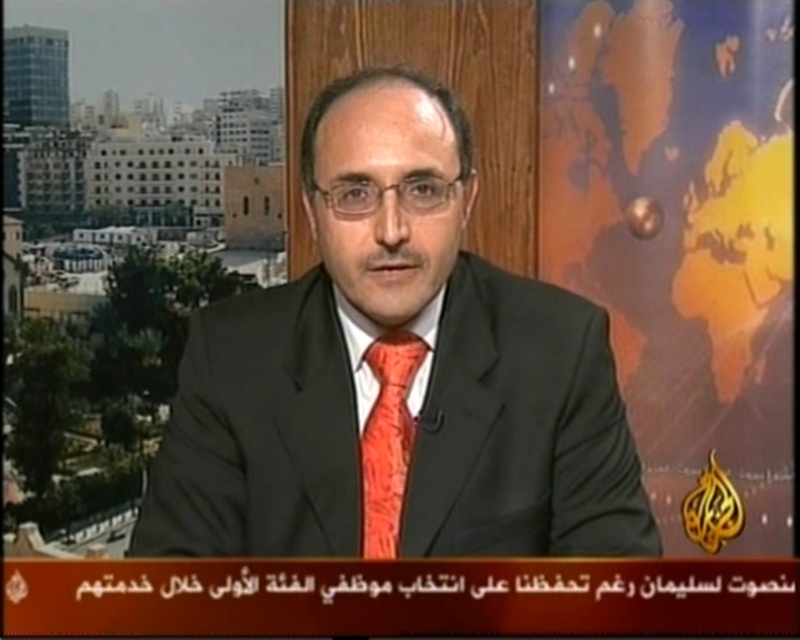
You are a fashion designer observing a man wearing an orange satin tie at center and a matte orange dress shirt at center. Which piece of clothing is smaller in size?

The orange satin tie at center is smaller in size compared to the matte orange dress shirt at center.

You are a fashion designer analyzing the image of a man in a studio. Where is the matte black suit at center positioned in relation to the large window in the background?

The matte black suit at center is positioned at coordinates point (396,374), which places it in the central area of the image, likely facing the large window in the background.